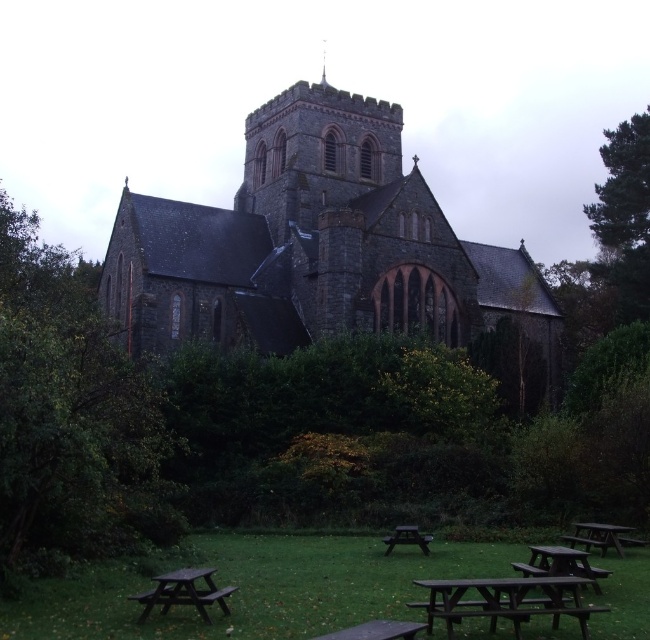
Is green leafy tree at left smaller than green textured tree at right?

No, green leafy tree at left is not smaller than green textured tree at right.

Between point (174, 449) and point (612, 256), which one is positioned behind?

The point (612, 256) is more distant.

The height and width of the screenshot is (640, 650). What do you see at coordinates (72, 413) in the screenshot?
I see `green leafy tree at left` at bounding box center [72, 413].

You are a GUI agent. You are given a task and a screenshot of the screen. Output one action in this format:
    pyautogui.click(x=<x>, y=<y>)
    Task: Click on the green leafy tree at left
    Image resolution: width=650 pixels, height=640 pixels.
    Given the screenshot: What is the action you would take?
    pyautogui.click(x=72, y=413)

Does green leafy tree at left have a greater width compared to wooden picnic table at lower right?

Yes.

Who is positioned more to the right, green leafy tree at left or wooden picnic table at lower right?

wooden picnic table at lower right

Identify the location of green leafy tree at left. (72, 413).

Find the location of a particular element. This screenshot has width=650, height=640. green leafy tree at left is located at coordinates (72, 413).

Who is more forward, (322,634) or (416,531)?

Point (322,634) is in front.

Between wooden park bench at lower center and wooden picnic table at lower center, which one has less height?

wooden picnic table at lower center

This screenshot has height=640, width=650. Identify the location of wooden park bench at lower center. (378, 630).